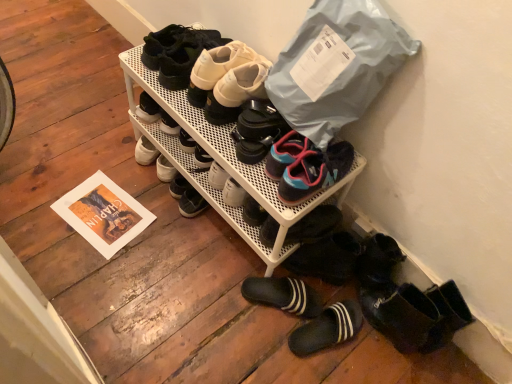
Find the location of `matte black shoes at upper center, marked as the first footwear in a top-to-bottom arrangement`. matte black shoes at upper center, marked as the first footwear in a top-to-bottom arrangement is located at coordinates (177, 52).

Image resolution: width=512 pixels, height=384 pixels. Describe the element at coordinates (177, 52) in the screenshot. I see `matte black shoes at upper center, acting as the eighth footwear starting from the bottom` at that location.

Find the location of a particular element. black rubber slippers at lower center, the 1th footwear in the bottom-to-top sequence is located at coordinates (327, 329).

You are a GUI agent. You are given a task and a screenshot of the screen. Output one action in this format:
    pyautogui.click(x=<x>, y=<y>)
    Task: Click on the blue mesh sneakers at center, acting as the sixth footwear starting from the top
    The width and height of the screenshot is (512, 384).
    Given the screenshot: What is the action you would take?
    pyautogui.click(x=315, y=172)

Identify the location of matte black shoes at upper center, marked as the first footwear in a top-to-bottom arrangement. The width and height of the screenshot is (512, 384). (177, 52).

Looking at this image, can you confirm if blue rubber sandals at center, the 5th footwear positioned from the top, is wider than black rubber shoes at center?

In fact, blue rubber sandals at center, the 5th footwear positioned from the top, might be narrower than black rubber shoes at center.

Are blue rubber sandals at center, the 5th footwear positioned from the top, and black rubber shoes at center beside each other?

No, blue rubber sandals at center, the 5th footwear positioned from the top, is not next to black rubber shoes at center.

Is blue rubber sandals at center, the 5th footwear positioned from the top, positioned in front of black rubber shoes at center?

No, it is behind black rubber shoes at center.

How many degrees apart are the facing directions of white mesh shoe rack at center, the 5th footwear ordered from the bottom, and black rubber shoes at center?

1.59 degrees.

Considering the sizes of objects white mesh shoe rack at center, which is counted as the fourth footwear, starting from the top, and black rubber shoes at center in the image provided, who is thinner, white mesh shoe rack at center, which is counted as the fourth footwear, starting from the top, or black rubber shoes at center?

Thinner between the two is white mesh shoe rack at center, which is counted as the fourth footwear, starting from the top.

In the image, is white mesh shoe rack at center, which is counted as the fourth footwear, starting from the top, on the left side or the right side of black rubber shoes at center?

Based on their positions, white mesh shoe rack at center, which is counted as the fourth footwear, starting from the top, is located to the right of black rubber shoes at center.

Looking at their sizes, would you say black rubber slippers at lower center, which is counted as the eighth footwear, starting from the top, is wider or thinner than black rubber shoe at center, the sixth footwear positioned from the bottom?

black rubber slippers at lower center, which is counted as the eighth footwear, starting from the top, is thinner than black rubber shoe at center, the sixth footwear positioned from the bottom.

Does black rubber slippers at lower center, the 1th footwear in the bottom-to-top sequence, have a greater height compared to black rubber shoe at center, the third footwear viewed from the top?

No.

Can you confirm if black rubber slippers at lower center, the 1th footwear in the bottom-to-top sequence, is positioned to the left of black rubber shoe at center, the third footwear viewed from the top?

No, black rubber slippers at lower center, the 1th footwear in the bottom-to-top sequence, is not to the left of black rubber shoe at center, the third footwear viewed from the top.

From a real-world perspective, is white mesh shoe rack at center, the 5th footwear ordered from the bottom, positioned under blue mesh sneakers at center, acting as the sixth footwear starting from the top, based on gravity?

Yes, from a real-world perspective, white mesh shoe rack at center, the 5th footwear ordered from the bottom, is under blue mesh sneakers at center, acting as the sixth footwear starting from the top.

Which of these two, white mesh shoe rack at center, which is counted as the fourth footwear, starting from the top, or blue mesh sneakers at center, positioned as the 3th footwear in bottom-to-top order, is wider?

Wider between the two is white mesh shoe rack at center, which is counted as the fourth footwear, starting from the top.

Which of these two, white mesh shoe rack at center, the 5th footwear ordered from the bottom, or blue mesh sneakers at center, positioned as the 3th footwear in bottom-to-top order, stands shorter?

blue mesh sneakers at center, positioned as the 3th footwear in bottom-to-top order, is shorter.

Is white matte sneakers at upper center, positioned as the 2th footwear in top-to-bottom order, oriented away from black rubber slippers at lower center, the 1th footwear in the bottom-to-top sequence?

No, white matte sneakers at upper center, positioned as the 2th footwear in top-to-bottom order, is not facing the opposite direction of black rubber slippers at lower center, the 1th footwear in the bottom-to-top sequence.

Between point (241, 50) and point (315, 343), which one is positioned behind?

The point (315, 343) is farther.

This screenshot has width=512, height=384. In order to click on the 7th footwear positioned below the white matte sneakers at upper center, positioned as the 2th footwear in top-to-bottom order (from a real-world perspective) in this screenshot , I will do `click(327, 329)`.

Who is more distant, white matte sneakers at upper center, positioned as the 2th footwear in top-to-bottom order, or black rubber slippers at lower center, the 1th footwear in the bottom-to-top sequence?

Positioned behind is black rubber slippers at lower center, the 1th footwear in the bottom-to-top sequence.

Consider the image. Is black rubber slipper at lower center, which appears as the seventh footwear when viewed from the top, not close to blue mesh sneakers at center, acting as the sixth footwear starting from the top?

No.

Is black rubber slipper at lower center, which is the second footwear from bottom to top, facing away from blue mesh sneakers at center, acting as the sixth footwear starting from the top?

No, black rubber slipper at lower center, which is the second footwear from bottom to top, is not facing the opposite direction of blue mesh sneakers at center, acting as the sixth footwear starting from the top.

Considering the relative sizes of black rubber slipper at lower center, which is the second footwear from bottom to top, and blue mesh sneakers at center, positioned as the 3th footwear in bottom-to-top order, in the image provided, is black rubber slipper at lower center, which is the second footwear from bottom to top, smaller than blue mesh sneakers at center, positioned as the 3th footwear in bottom-to-top order,?

Yes.

From a real-world perspective, which is physically below, black rubber slipper at lower center, which is the second footwear from bottom to top, or blue mesh sneakers at center, acting as the sixth footwear starting from the top?

In real-world perspective, black rubber slipper at lower center, which is the second footwear from bottom to top, is lower.

From a real-world perspective, is black rubber shoe at center, the third footwear viewed from the top, on top of black rubber shoes at center?

Yes.

From the image's perspective, is black rubber shoe at center, the third footwear viewed from the top, over black rubber shoes at center?

Yes, from the image's perspective, black rubber shoe at center, the third footwear viewed from the top, is over black rubber shoes at center.

Is point (268, 135) positioned behind point (270, 229)?

No, it is in front of (270, 229).

From their relative heights in the image, would you say black rubber shoe at center, the third footwear viewed from the top, is taller or shorter than black rubber shoes at center?

Considering their sizes, black rubber shoe at center, the third footwear viewed from the top, has more height than black rubber shoes at center.

I want to click on collection below the blue rubber sandals at center, which ranks as the fourth footwear in bottom-to-top order (from the image's perspective), so click(x=411, y=306).

Locate an element on the screen. This screenshot has width=512, height=384. collection that appears in front of the white mesh shoe rack at center, the 5th footwear ordered from the bottom is located at coordinates 411,306.

Looking at the image, which one is located further to black rubber shoes at center, black rubber slipper at lower center, which is the second footwear from bottom to top, or matte black shoes at upper center, acting as the eighth footwear starting from the bottom?

The object further to black rubber shoes at center is matte black shoes at upper center, acting as the eighth footwear starting from the bottom.

Based on their spatial positions, is matte black shoes at upper center, acting as the eighth footwear starting from the bottom, or black rubber slippers at lower center, the 1th footwear in the bottom-to-top sequence, closer to blue mesh sneakers at center, positioned as the 3th footwear in bottom-to-top order?

Among the two, black rubber slippers at lower center, the 1th footwear in the bottom-to-top sequence, is located nearer to blue mesh sneakers at center, positioned as the 3th footwear in bottom-to-top order.

Estimate the real-world distances between objects in this image. Which object is further from white mesh shoe rack at center, the 5th footwear ordered from the bottom, blue mesh sneakers at center, acting as the sixth footwear starting from the top, or blue rubber sandals at center, which ranks as the fourth footwear in bottom-to-top order?

blue mesh sneakers at center, acting as the sixth footwear starting from the top.

Looking at the image, which one is located further to white matte sneakers at upper center, positioned as the 2th footwear in top-to-bottom order, black rubber shoe at center, the sixth footwear positioned from the bottom, or white mesh shoe rack at center, which is counted as the fourth footwear, starting from the top?

Based on the image, black rubber shoe at center, the sixth footwear positioned from the bottom, appears to be further to white matte sneakers at upper center, positioned as the 2th footwear in top-to-bottom order.

When comparing their distances from white mesh shoe rack at center, which is counted as the fourth footwear, starting from the top, does blue rubber sandals at center, the 5th footwear positioned from the top, or blue mesh sneakers at center, acting as the sixth footwear starting from the top, seem closer?

The object closer to white mesh shoe rack at center, which is counted as the fourth footwear, starting from the top, is blue rubber sandals at center, the 5th footwear positioned from the top.

Estimate the real-world distances between objects in this image. Which object is closer to blue mesh sneakers at center, acting as the sixth footwear starting from the top, black rubber shoes at center or white matte sneakers at upper center, which is the seventh footwear in bottom-to-top order?

black rubber shoes at center.

Considering their positions, is blue rubber sandals at center, which ranks as the fourth footwear in bottom-to-top order, positioned closer to black rubber shoe at center, the sixth footwear positioned from the bottom, than white matte sneakers at upper center, positioned as the 2th footwear in top-to-bottom order?

blue rubber sandals at center, which ranks as the fourth footwear in bottom-to-top order, is closer to black rubber shoe at center, the sixth footwear positioned from the bottom.

When comparing their distances from black rubber slippers at lower center, which is counted as the eighth footwear, starting from the top, does black rubber shoe at center, the third footwear viewed from the top, or white matte sneakers at upper center, which is the seventh footwear in bottom-to-top order, seem further?

The object further to black rubber slippers at lower center, which is counted as the eighth footwear, starting from the top, is white matte sneakers at upper center, which is the seventh footwear in bottom-to-top order.

The width and height of the screenshot is (512, 384). Identify the location of collection between matte black shoes at upper center, acting as the eighth footwear starting from the bottom, and black rubber slipper at lower center, which is the second footwear from bottom to top, in the up-down direction. (411, 306).

Image resolution: width=512 pixels, height=384 pixels. I want to click on footwear between black rubber shoes at center and white matte sneakers at upper center, positioned as the 2th footwear in top-to-bottom order, from left to right, so click(177, 52).

Identify the location of collection between white matte sneakers at upper center, which is the seventh footwear in bottom-to-top order, and black rubber slipper at lower center, which appears as the seventh footwear when viewed from the top, in the up-down direction. (411, 306).

Where is `collection between white matte sneakers at upper center, positioned as the 2th footwear in top-to-bottom order, and black rubber slippers at lower center, the 1th footwear in the bottom-to-top sequence, from top to bottom`? This screenshot has height=384, width=512. collection between white matte sneakers at upper center, positioned as the 2th footwear in top-to-bottom order, and black rubber slippers at lower center, the 1th footwear in the bottom-to-top sequence, from top to bottom is located at coordinates (411, 306).